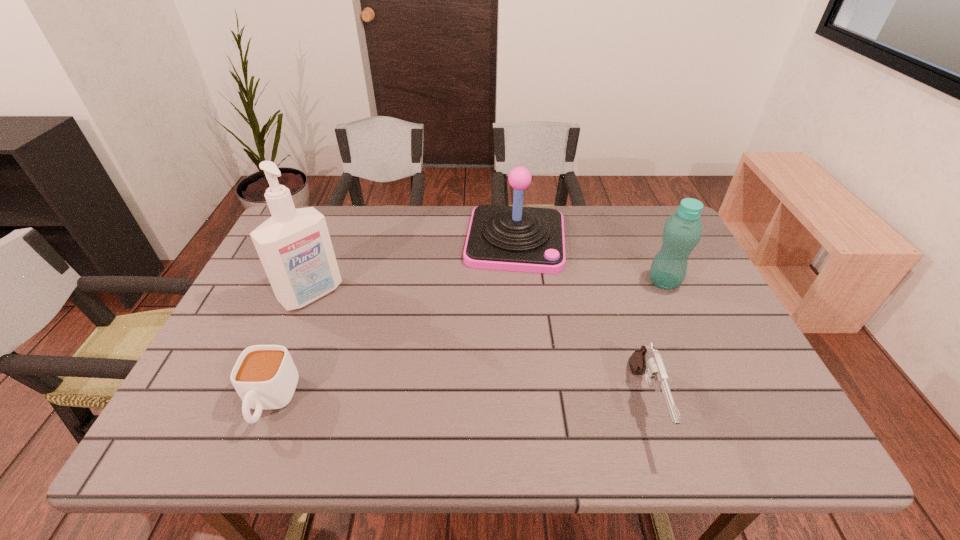
At what (x,y) coordinates should I click in order to perform the action: click on cup. Please return your answer as a coordinate pair (x, y). The image size is (960, 540). Looking at the image, I should click on (265, 377).

At what (x,y) coordinates should I click in order to perform the action: click on gun. Please return your answer as a coordinate pair (x, y). Looking at the image, I should click on (647, 360).

Identify the location of the second shortest object. (647, 360).

I want to click on cleansing agent, so click(x=294, y=245).

At what (x,y) coordinates should I click in order to perform the action: click on the rightmost object. Please return your answer as a coordinate pair (x, y). This screenshot has height=540, width=960. Looking at the image, I should click on (682, 231).

This screenshot has height=540, width=960. In order to click on the third object from right to left in this screenshot , I will do `click(511, 238)`.

What are the coordinates of `vacant area situated 0.180m on the front label of the cleansing agent` in the screenshot? It's located at (366, 347).

The image size is (960, 540). Find the location of `free region located 0.130m on the front label of the cleansing agent`. free region located 0.130m on the front label of the cleansing agent is located at coordinates (354, 336).

Find the location of a particular element. This screenshot has height=540, width=960. vacant space located 0.080m on the front label of the cleansing agent is located at coordinates (343, 325).

Where is `free space located 0.130m at the front cap of the rightmost object`? The width and height of the screenshot is (960, 540). free space located 0.130m at the front cap of the rightmost object is located at coordinates (620, 308).